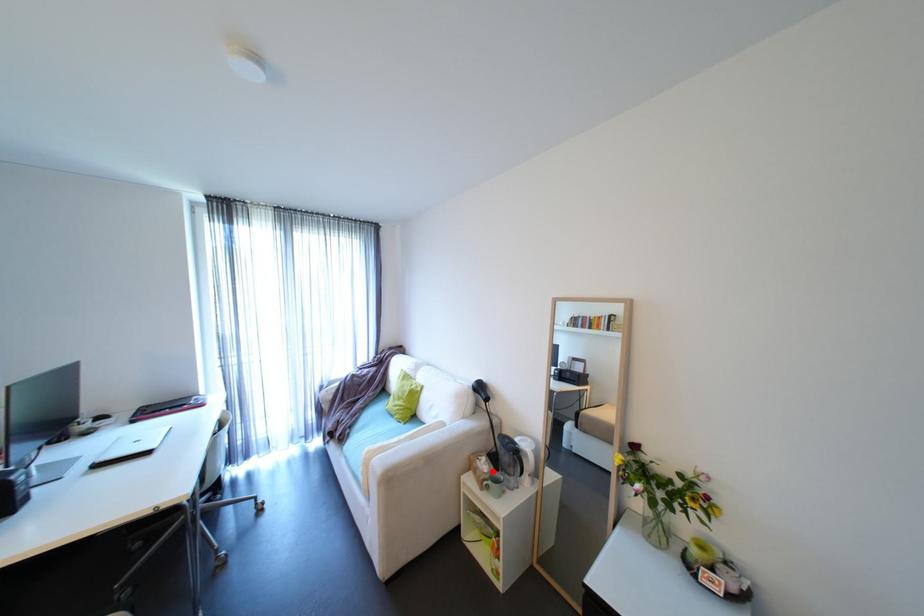
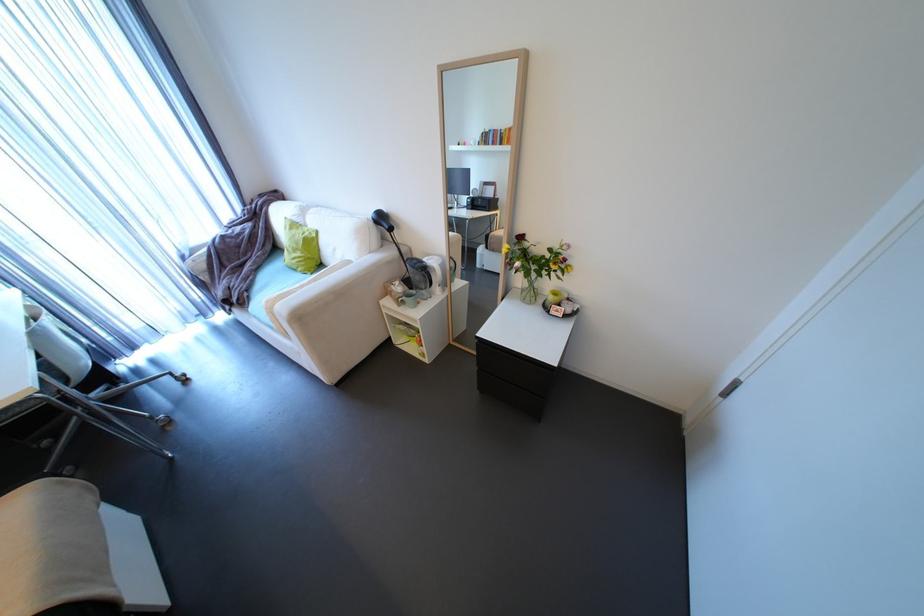
Question: I am providing you with two images of the same scene from different viewpoints. In image1, a red point is highlighted. Considering the same 3D point in image2, which of the following is correct?

Choices:
 (A) It is closer
 (B) It is farther

Answer: (A)